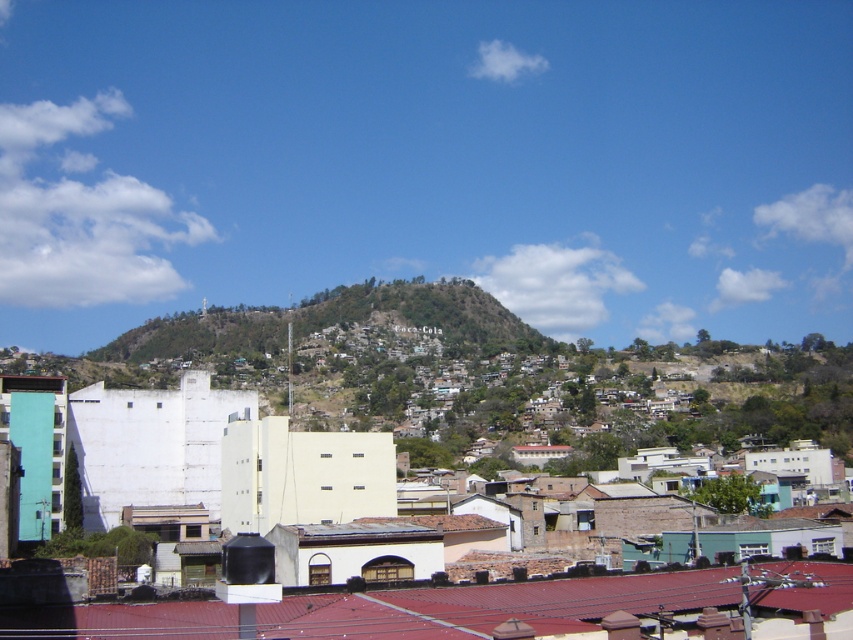
You are an urban planner reviewing this area. You need to determine if the white matte building at center can be expanded to match the width of the green grassy hillside at center. Based on the current layout, is this feasible?

The white matte building at center has a lesser width compared to the green grassy hillside at center, so it is possible to expand the white matte building at center to match the width of the green grassy hillside at center if there is sufficient space available on the site.